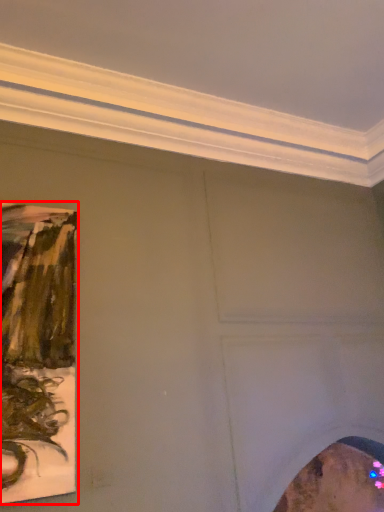
Question: Considering the relative positions of picture frame (annotated by the red box) and picture frame in the image provided, where is picture frame (annotated by the red box) located with respect to the staircase?

Choices:
 (A) left
 (B) right

Answer: (A)